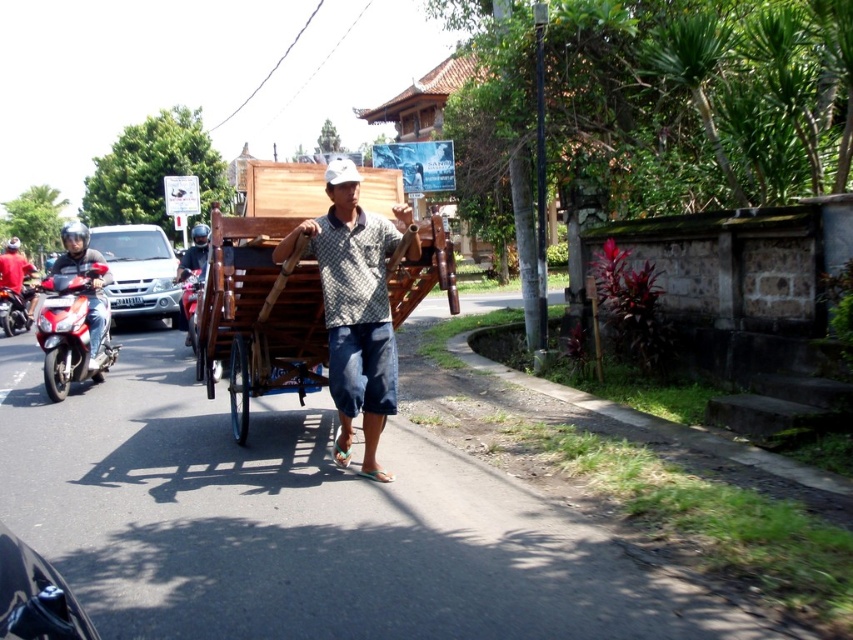
You are a delivery person who needs to park your vehicle on the street. You have a silver metallic car at left and a red glossy motorcycle at left. Which one should you move to park your new vehicle between them?

The silver metallic car at left is to the right of the red glossy motorcycle at left, so you should park your new vehicle between the red glossy motorcycle at left and the silver metallic car at left.

You are a delivery person who needs to park your vehicle between the shiny red motorcycle at left and the silver metallic car at left. Your vehicle is 1.2 meters wide. Can you fit your vehicle in the space between them?

The shiny red motorcycle at left is thinner than the silver metallic car at left, so the space between them may be sufficient. However, without knowing the exact distance between the two vehicles, it is impossible to determine if your 1.2 meter wide vehicle can fit.

You are standing at the center of the street and see the shiny red motorcycle at left. If you want to reach the motorcycle, which direction should you move in?

You should move to your left since the shiny red motorcycle at left is located at point (70, 332), which is on the left side of the street.